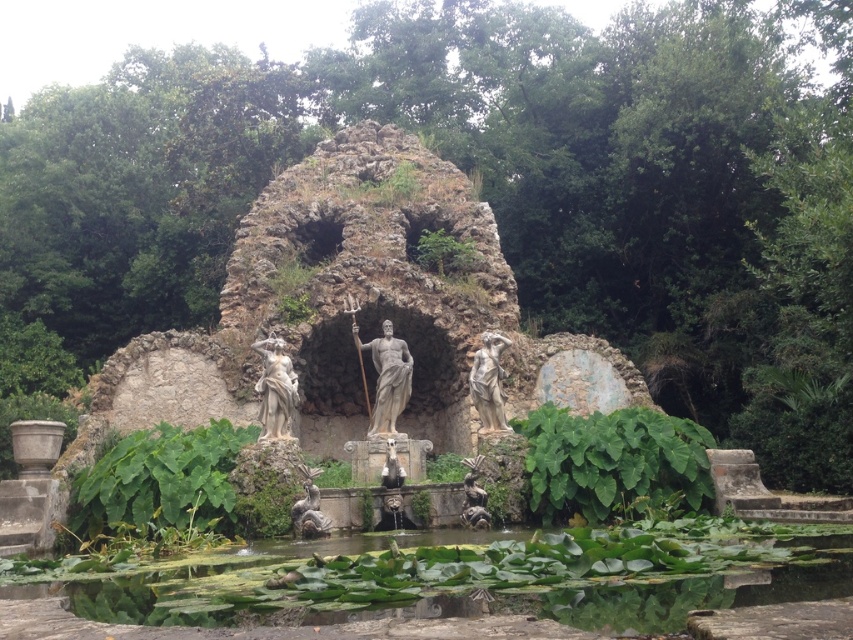
You are a landscape architect designing a pathway between the matte bronze statue at center and the polished bronze statue at center. Given that the minimum required distance between two statues for proper plant growth is 15 meters, is the current distance sufficient?

The distance between the matte bronze statue at center and the polished bronze statue at center is 14.38 meters, which is less than the required 15 meters. Therefore, the current distance is not sufficient for proper plant growth.

You are standing in the garden and want to place a small decorative statue between the two points, point [310,477] and point [474,468]. Which point should you stand closer to ensure the statue is placed in front of the fountain?

You should stand closer to point [310,477] because it is closer to the viewer than point [474,468], so placing the statue there would position it in front of the fountain.